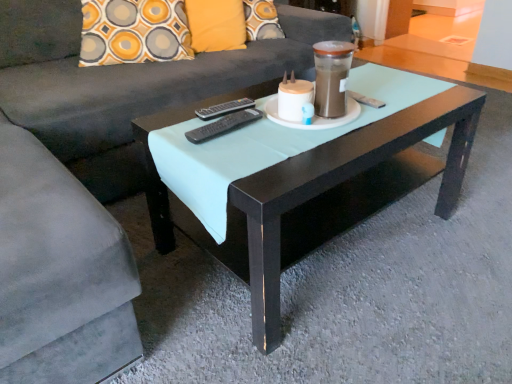
At what (x,y) coordinates should I click in order to perform the action: click on vacant area to the right of black plastic remote at center, the first remote in the front-to-back sequence. Please return your answer as a coordinate pair (x, y). Looking at the image, I should click on (282, 136).